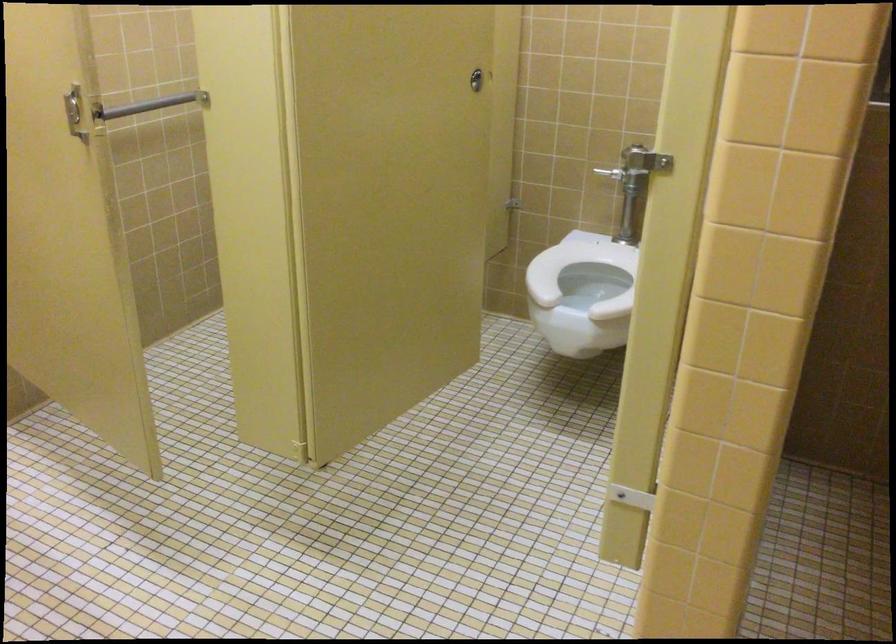
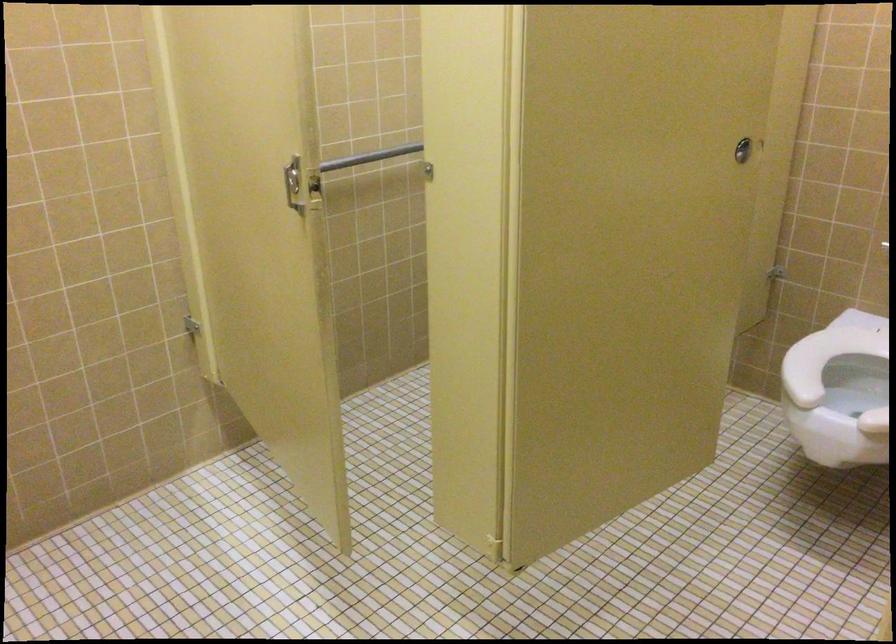
In the second image, find the point that corresponds to (567,278) in the first image.

(836, 362)